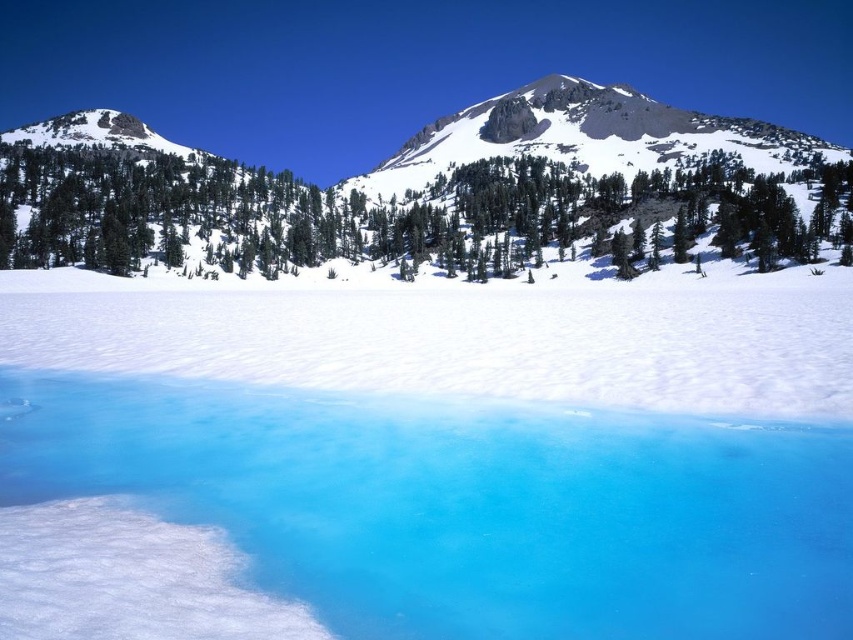
Question: In this image, where is translucent ice water at center located relative to green matte tree at center?

Choices:
 (A) right
 (B) left

Answer: (A)

Question: Which point is farther to the camera?

Choices:
 (A) (714, 532)
 (B) (256, 220)

Answer: (B)

Question: Which of the following is the farthest from the observer?

Choices:
 (A) translucent ice water at center
 (B) green matte tree at center

Answer: (B)

Question: Does translucent ice water at center have a larger size compared to green matte tree at center?

Choices:
 (A) no
 (B) yes

Answer: (A)

Question: Does translucent ice water at center appear under green matte tree at center?

Choices:
 (A) no
 (B) yes

Answer: (B)